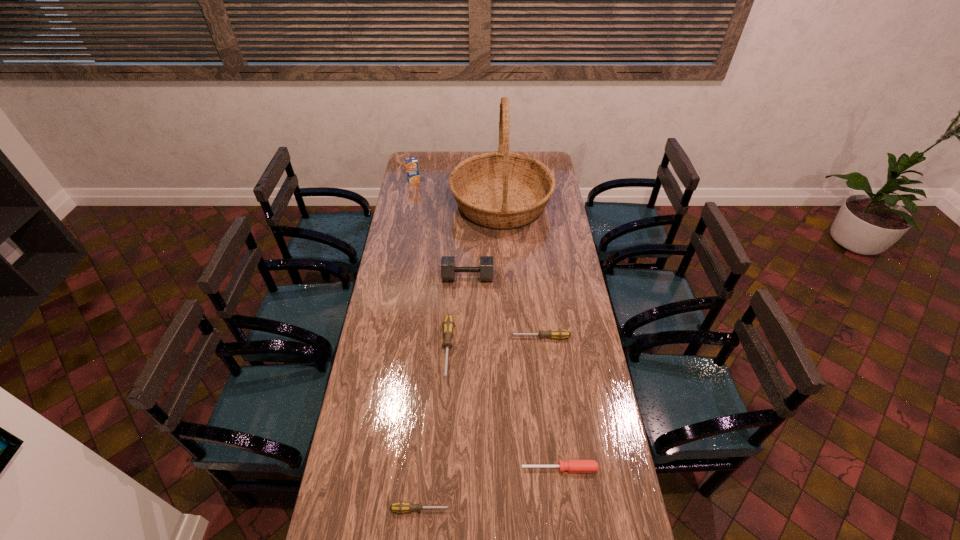
Identify the location of object that can be found as the second closest to the orange_juice. (448, 269).

At what (x,y) coordinates should I click in order to perform the action: click on the fifth closest object to the basket. Please return your answer as a coordinate pair (x, y). The width and height of the screenshot is (960, 540). Looking at the image, I should click on click(x=573, y=466).

Identify the location of screwdriver object that ranks as the third closest to the fourth shortest object. (400, 507).

In order to click on screwdriver that is the third closest to the second tallest screwdriver in this screenshot , I will do `click(400, 507)`.

Identify which gray screwdriver is the closest to the basket. Please provide its 2D coordinates. Your answer should be formatted as a tuple, i.e. [(x, y)], where the tuple contains the x and y coordinates of a point satisfying the conditions above.

[(448, 325)]

This screenshot has width=960, height=540. What are the coordinates of `gray screwdriver that is the closest to the nearest object` in the screenshot? It's located at (448, 325).

The image size is (960, 540). Find the location of `free space that satisfies the following two spatial constraints: 1. on the front side of the second nearest object; 2. on the right side of the blue orange_juice`. free space that satisfies the following two spatial constraints: 1. on the front side of the second nearest object; 2. on the right side of the blue orange_juice is located at coordinates (361, 468).

Where is `free space that satisfies the following two spatial constraints: 1. at the tip of the red screwdriver; 2. on the left side of the tallest screwdriver`? The height and width of the screenshot is (540, 960). free space that satisfies the following two spatial constraints: 1. at the tip of the red screwdriver; 2. on the left side of the tallest screwdriver is located at coordinates (441, 468).

Locate an element on the screen. The height and width of the screenshot is (540, 960). free space in the image that satisfies the following two spatial constraints: 1. at the tip of the fourth shortest object; 2. at the tip of the smallest gray screwdriver is located at coordinates (438, 509).

Where is `vacant area in the image that satisfies the following two spatial constraints: 1. on the front side of the second nearest object; 2. at the tip of the nearest gray screwdriver`? vacant area in the image that satisfies the following two spatial constraints: 1. on the front side of the second nearest object; 2. at the tip of the nearest gray screwdriver is located at coordinates (564, 509).